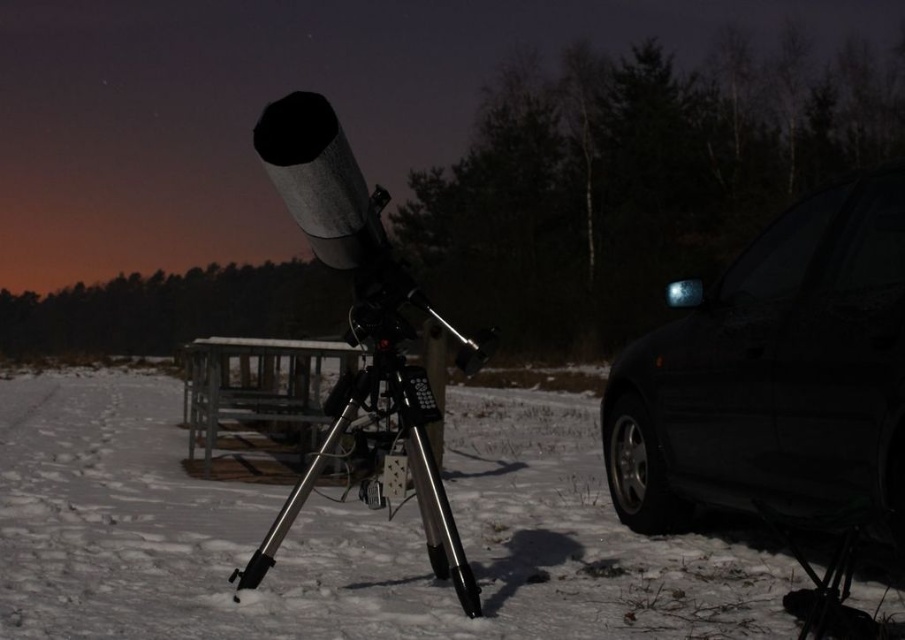
You are an astronomer setting up equipment for a star observation. You have a black glossy car at right and a silver metallic tripod at center in your view. You need to move a 5 feet long equipment case from the car to the tripod. Can you move it directly without needing to adjust the path?

The distance between the black glossy car at right and the silver metallic tripod at center is 4.86 feet. Since the equipment case is 5 feet long, it cannot be moved directly between them without adjusting the path because the distance is shorter than the case length.

You are an astronomer setting up equipment in the snowy area. You have a white matte snow at center and a silver metallic tripod at center. Which object is taller?

The silver metallic tripod at center is taller than the white matte snow at center.